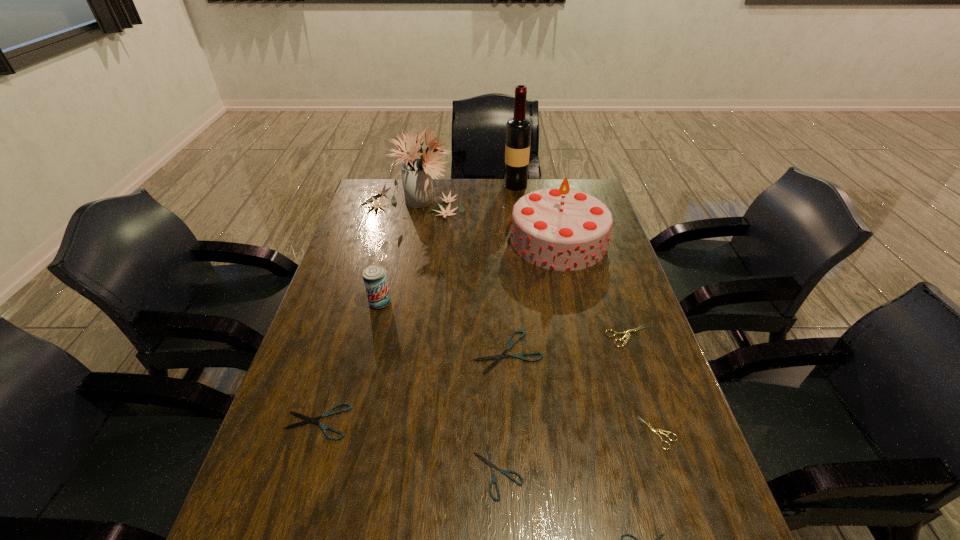
This screenshot has width=960, height=540. Find the location of `vacant region located 0.370m on the back of the second smallest black shears`. vacant region located 0.370m on the back of the second smallest black shears is located at coordinates (493, 319).

Locate an element on the screen. The width and height of the screenshot is (960, 540). wine bottle positioned at the far edge is located at coordinates (518, 129).

This screenshot has height=540, width=960. Identify the location of bouquet that is positioned at the far edge. (417, 173).

You are a GUI agent. You are given a task and a screenshot of the screen. Output one action in this format:
    pyautogui.click(x=<x>, y=<y>)
    Task: Click on the bouquet that is at the left edge
    
    Given the screenshot: What is the action you would take?
    pyautogui.click(x=417, y=173)

Identify the location of beer can located in the left edge section of the desktop. The height and width of the screenshot is (540, 960). (375, 280).

Locate an element on the screen. The image size is (960, 540). shears present at the left edge is located at coordinates (308, 419).

Where is `birthday cake present at the right edge`? The width and height of the screenshot is (960, 540). birthday cake present at the right edge is located at coordinates (561, 229).

Image resolution: width=960 pixels, height=540 pixels. Find the location of `object at the far left corner`. object at the far left corner is located at coordinates (417, 173).

In the image, there is a desktop. At what (x,y) coordinates should I click in order to perform the action: click on free space at the far edge. Please return your answer as a coordinate pair (x, y). Looking at the image, I should click on (447, 187).

The width and height of the screenshot is (960, 540). I want to click on vacant space at the left edge of the desktop, so click(257, 524).